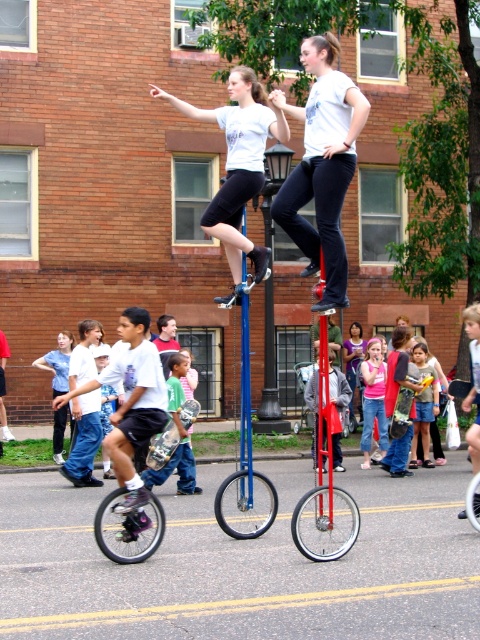
Does point (415, 440) lie in front of point (478, 369)?

No.

Is denim shorts at center to the right of brushed metal skateboard at lower left from the viewer's perspective?

Yes, denim shorts at center is to the right of brushed metal skateboard at lower left.

Where is `denim shorts at center`? This screenshot has height=640, width=480. denim shorts at center is located at coordinates (423, 406).

Who is lower down, white cotton shirt at lower left or shiny metallic unicycle at lower left?

shiny metallic unicycle at lower left

Between white cotton shirt at lower left and shiny metallic unicycle at lower left, which one appears on the right side from the viewer's perspective?

shiny metallic unicycle at lower left is more to the right.

Between point (80, 376) and point (111, 529), which one is positioned behind?

The point (80, 376) is more distant.

Identify the location of white cotton shirt at lower left. (84, 440).

The width and height of the screenshot is (480, 640). Describe the element at coordinates (238, 161) in the screenshot. I see `matte white t-shirt at upper center` at that location.

Is matte white t-shirt at upper center taller than green matte skateboard at lower left?

Yes, matte white t-shirt at upper center is taller than green matte skateboard at lower left.

Between point (222, 113) and point (171, 388), which one is positioned in front?

Point (222, 113) is more forward.

This screenshot has width=480, height=640. Identify the location of matte white t-shirt at upper center. (238, 161).